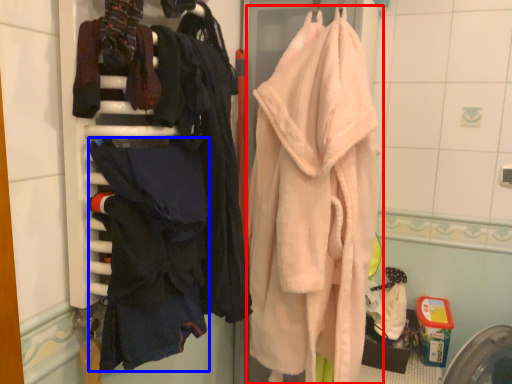
Question: Which of the following is the closest to the observer, towel (highlighted by a red box) or clothing (highlighted by a blue box)?

Choices:
 (A) towel
 (B) clothing

Answer: (B)